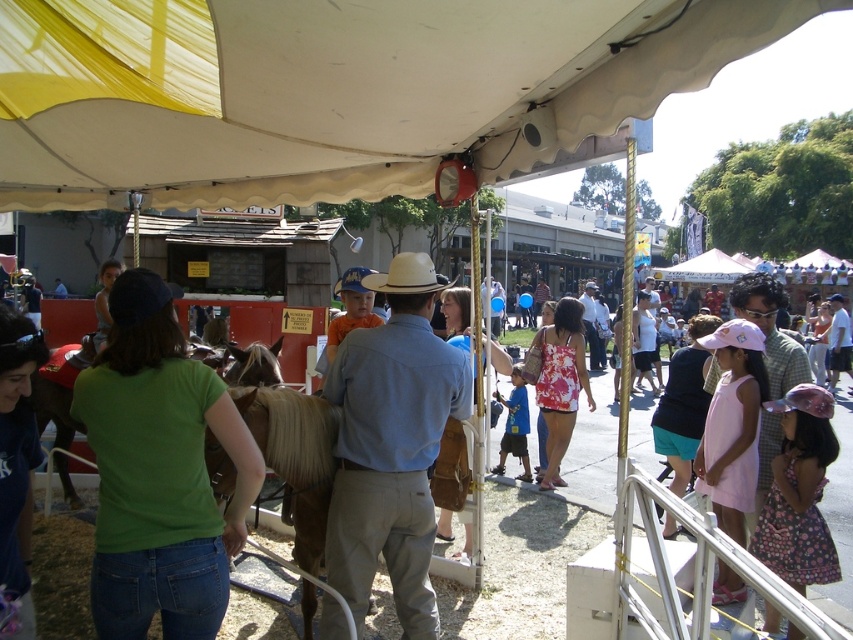
Question: Which point appears closest to the camera in this image?

Choices:
 (A) (415, 285)
 (B) (425, 280)
 (C) (370, 97)
 (D) (788, 369)

Answer: (C)

Question: Estimate the real-world distances between objects in this image. Which object is closer to the green cotton shirt at lower left?

Choices:
 (A) light blue cotton shirt at center
 (B) light brown leather cowboy hat at center

Answer: (A)

Question: Can you confirm if green cotton shirt at lower left is positioned to the right of light blue cotton shirt at center?

Choices:
 (A) yes
 (B) no

Answer: (B)

Question: Is green cotton shirt at lower left smaller than light blue cotton shirt at center?

Choices:
 (A) yes
 (B) no

Answer: (A)

Question: Does white fabric canopy at upper center appear on the right side of white matte cowboy hat at center?

Choices:
 (A) no
 (B) yes

Answer: (A)

Question: Based on their relative distances, which object is farther from the white fabric canopy at upper center?

Choices:
 (A) light blue cotton shirt at center
 (B) green cotton shirt at lower left
 (C) light brown leather cowboy hat at center

Answer: (C)